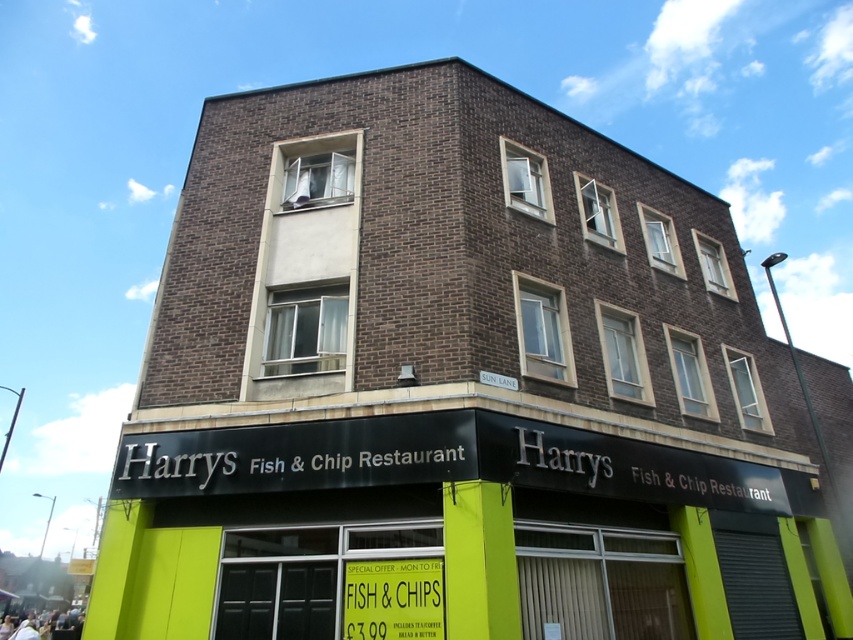
Question: In this image, where is green matte signboard at lower center located relative to yellow paper sign at lower center?

Choices:
 (A) right
 (B) left

Answer: (A)

Question: Is green matte signboard at lower center below yellow paper sign at lower center?

Choices:
 (A) yes
 (B) no

Answer: (B)

Question: Which point appears farthest from the camera in this image?

Choices:
 (A) (426, 627)
 (B) (332, 456)

Answer: (B)

Question: Can you confirm if green matte signboard at lower center is thinner than yellow paper sign at lower center?

Choices:
 (A) yes
 (B) no

Answer: (B)